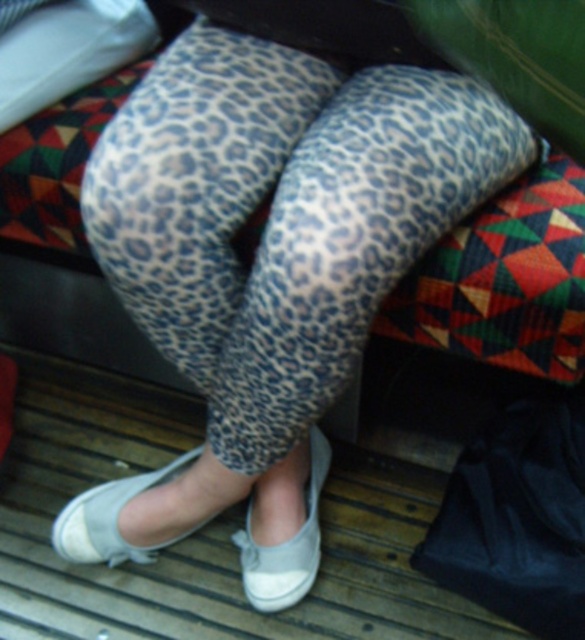
Question: Is leopard print leggings at center positioned in front of gray fabric shoe at lower center?

Choices:
 (A) no
 (B) yes

Answer: (B)

Question: Is leopard print leggings at center closer to the viewer compared to gray fabric shoe at lower center?

Choices:
 (A) yes
 (B) no

Answer: (A)

Question: Which point is closer to the camera taking this photo?

Choices:
 (A) (269, 186)
 (B) (118, 516)
 (C) (273, 556)

Answer: (A)

Question: Which of the following is the closest to the observer?

Choices:
 (A) white canvas shoe at lower center
 (B) white fabric sock at lower center

Answer: (B)

Question: Which object is positioned farthest from the gray fabric shoe at lower center?

Choices:
 (A) white fabric sock at lower center
 (B) leopard print leggings at center
 (C) white canvas shoe at lower center

Answer: (B)

Question: Can you confirm if leopard print leggings at center is bigger than white canvas shoe at lower center?

Choices:
 (A) no
 (B) yes

Answer: (B)